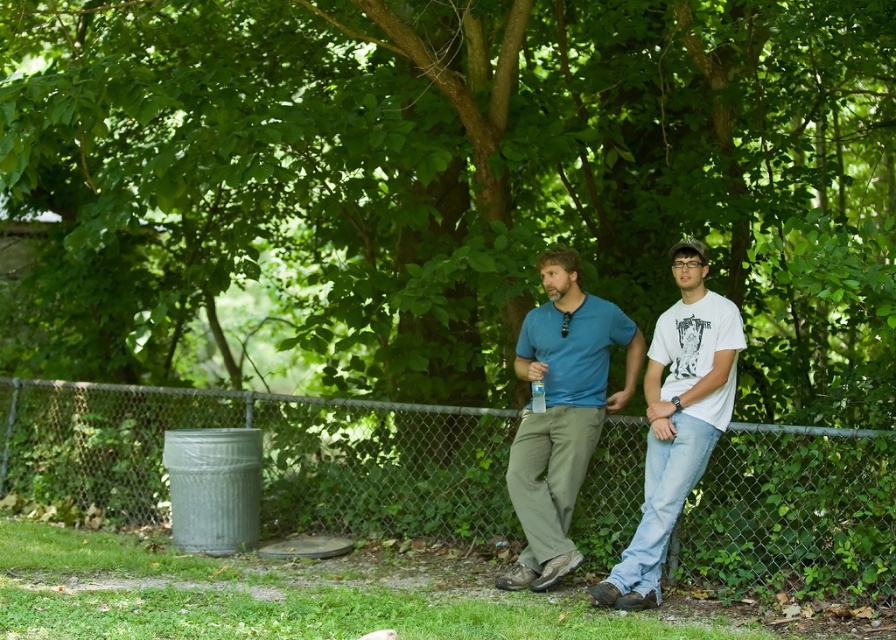
You are a photographer trying to capture a candid shot of the two people in the park. You want to ensure the person in the matte blue shirt at center is in focus. Given their position at point (561, 413), where should you aim your camera to include both individuals in the frame?

The matte blue shirt at center is located at point (561, 413). To include both individuals in the frame, aim the camera so that the point (561, 413) is centered, ensuring the other person behind is also within the shot.